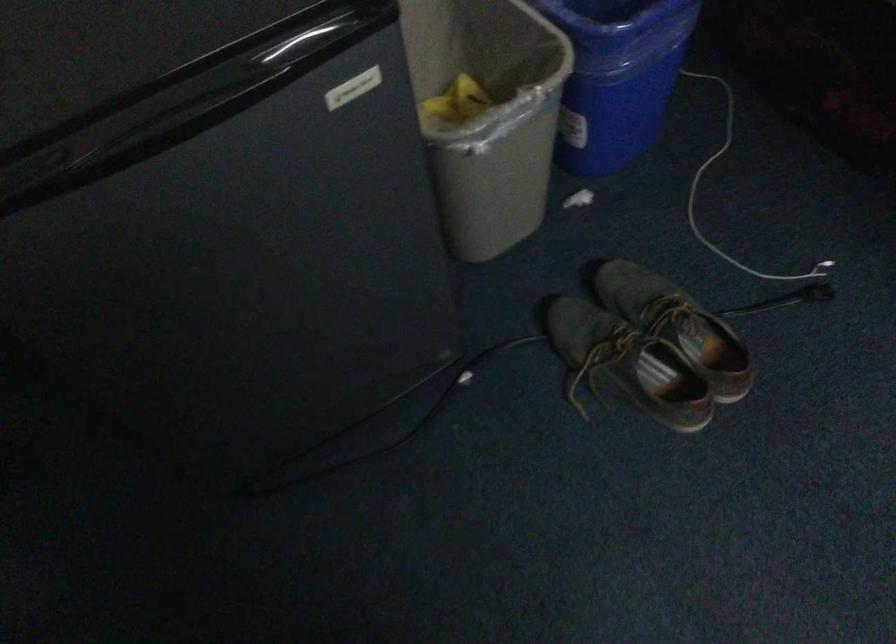
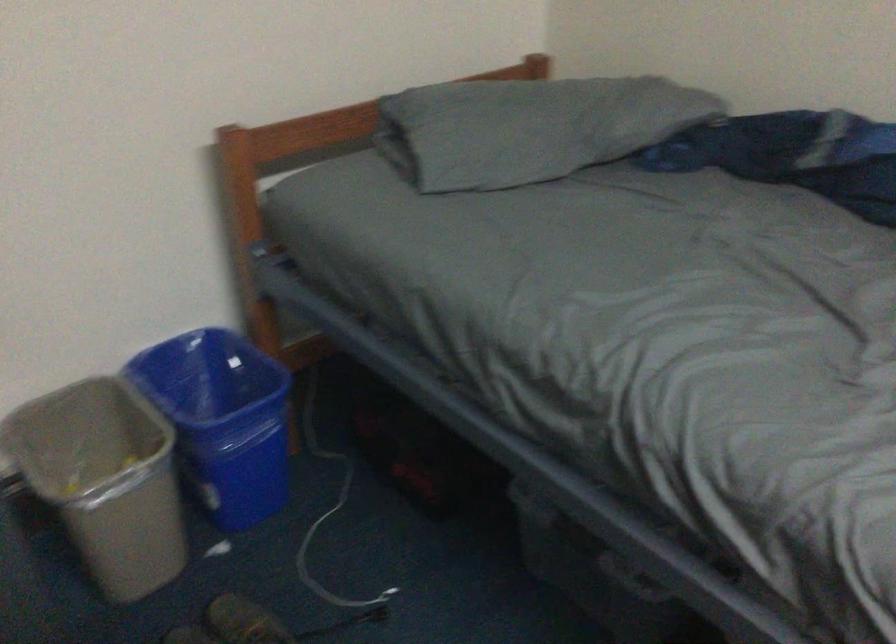
Locate, in the second image, the point that corresponds to pixel 709 149 in the first image.

(328, 509)